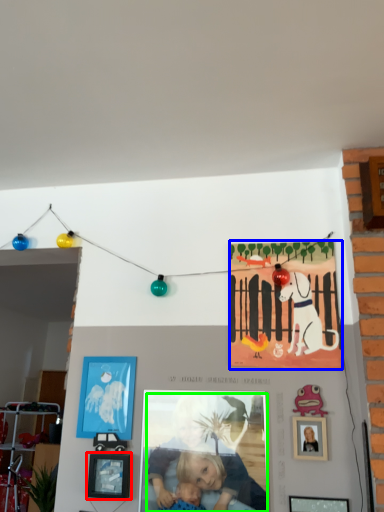
Question: Based on their relative distances, which object is farther from picture frame (highlighted by a red box)? Choose from poster (highlighted by a blue box) and person (highlighted by a green box).

Choices:
 (A) poster
 (B) person

Answer: (A)